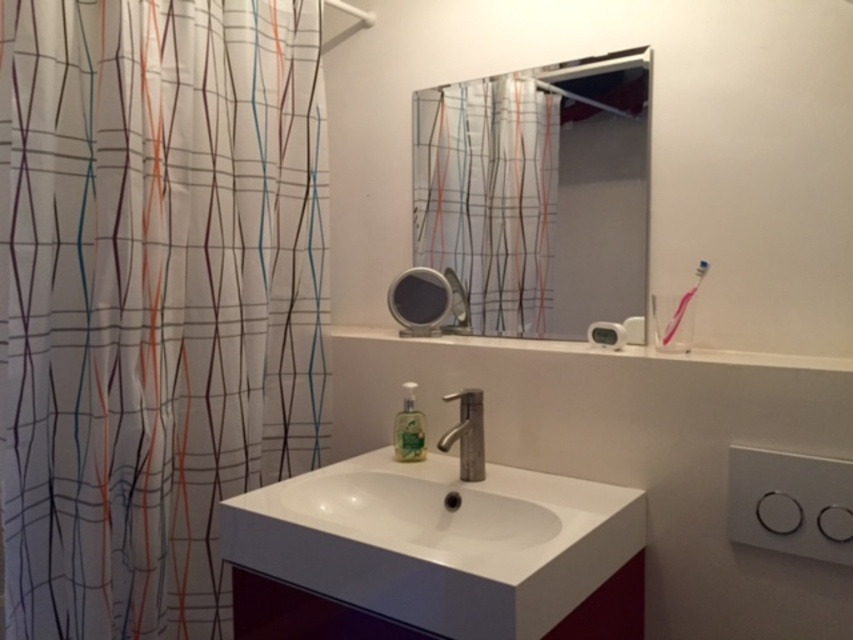
Who is more distant from viewer, (173, 604) or (469, 420)?

Point (173, 604)

Can you confirm if transparent plastic shower curtain at left is smaller than silver metallic faucet at center?

Incorrect, transparent plastic shower curtain at left is not smaller in size than silver metallic faucet at center.

Who is more forward, (x=134, y=218) or (x=471, y=420)?

Positioned in front is point (x=134, y=218).

Find the location of a particular element. This screenshot has width=853, height=640. transparent plastic shower curtain at left is located at coordinates (152, 298).

Who is taller, silver metallic faucet at center or translucent green liquid at sink?

With more height is silver metallic faucet at center.

Is silver metallic faucet at center positioned before translucent green liquid at sink?

Yes, it is in front of translucent green liquid at sink.

What do you see at coordinates (467, 433) in the screenshot? I see `silver metallic faucet at center` at bounding box center [467, 433].

Where is `silver metallic faucet at center`? This screenshot has width=853, height=640. silver metallic faucet at center is located at coordinates (467, 433).

The height and width of the screenshot is (640, 853). Describe the element at coordinates (152, 298) in the screenshot. I see `transparent plastic shower curtain at left` at that location.

Between transparent plastic shower curtain at left and metallic faucet at center, which one has less height?

metallic faucet at center is shorter.

Describe the element at coordinates (152, 298) in the screenshot. Image resolution: width=853 pixels, height=640 pixels. I see `transparent plastic shower curtain at left` at that location.

The width and height of the screenshot is (853, 640). In order to click on transparent plastic shower curtain at left in this screenshot , I will do `click(152, 298)`.